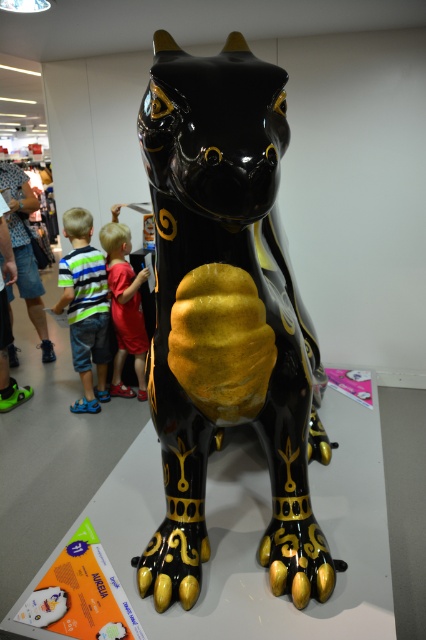
Consider the image. You are a visitor at a museum and see the glossy black and gold statue at center and the red shirt at center. Which object is closer to you?

The glossy black and gold statue at center is closer to you than the red shirt at center.

You are a museum visitor standing in front of the glossy black and gold statue at center. You want to take a photo of the statue without any people in the frame. The striped fabric shirt at lower left is currently blocking your view. Which object should you move to get a clear shot?

The glossy black and gold statue at center is in front of striped fabric shirt at lower left. To take a photo of the statue without the striped fabric shirt at lower left blocking the view, you should move the striped fabric shirt at lower left out of the way since it is behind the statue from your perspective.

You are a security guard in the museum. You notice the glossy black and gold statue at center and the red shirt at center. Which object is closer to the ceiling?

The glossy black and gold statue at center is positioned under the red shirt at center, so the red shirt at center is closer to the ceiling.